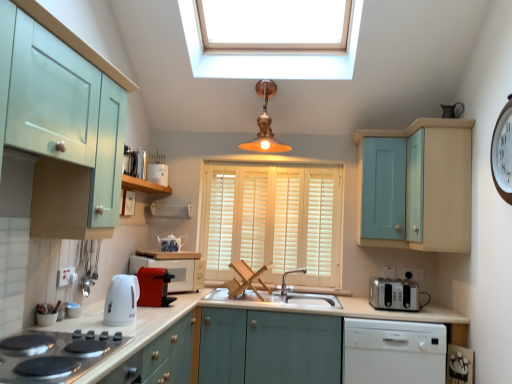
The image size is (512, 384). What are the coordinates of `free point below silver metallic faucet at center (from a real-world perspective)` in the screenshot? It's located at (291, 295).